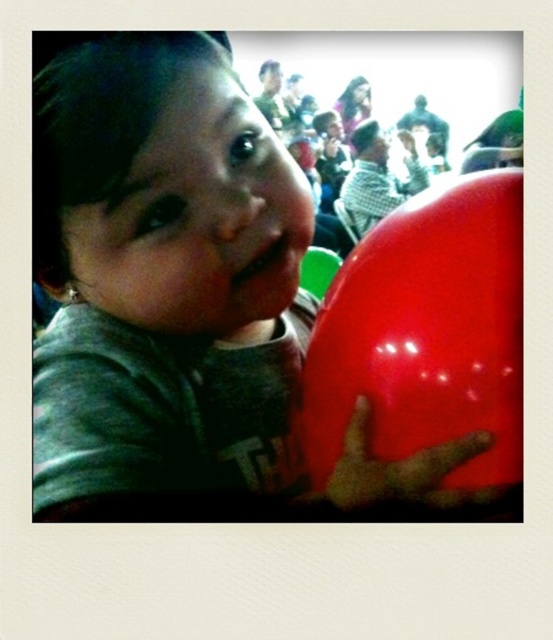
You are at a birthday party and see two balloons, a matte plastic balloon at center and a glossy red balloon at right. Which one is positioned more to the left?

The matte plastic balloon at center is positioned more to the left than the glossy red balloon at right.

You are a photographer at a birthday party. You need to capture a photo of the glossy red balloon at right and the rubber glove at right. The client wants to know which object is taller in the photo. Based on the scene description, what should you tell them?

The glossy red balloon at right is taller than the rubber glove at right.

You are a party planner organizing a childrens event. You have a matte plastic balloon at center and a rubber glove at right. Which object is taller?

The matte plastic balloon at center is taller than the rubber glove at right.